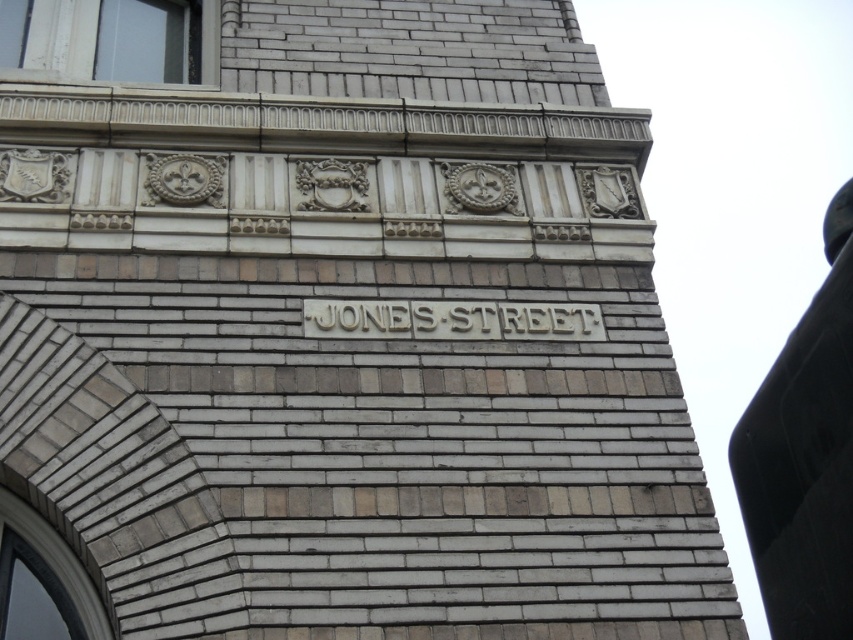
Which is below, black glossy sign at upper center or carved stone jones street sign at center?

black glossy sign at upper center

Image resolution: width=853 pixels, height=640 pixels. What do you see at coordinates (804, 458) in the screenshot?
I see `black glossy sign at upper center` at bounding box center [804, 458].

I want to click on black glossy sign at upper center, so click(x=804, y=458).